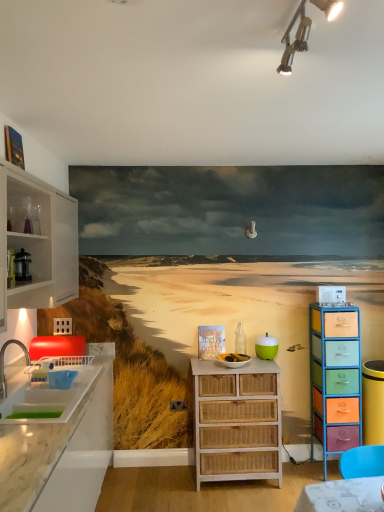
Question: Which direction should I rotate to look at white wicker chest of drawers at center, positioned as the second chest of drawers in right-to-left order?

Choices:
 (A) right
 (B) left

Answer: (A)

Question: Is white plastic microwave at upper right, which is the 3th appliance from front to back, inside metallic track lighting at upper center?

Choices:
 (A) yes
 (B) no

Answer: (B)

Question: From the image's perspective, is metallic track lighting at upper center under white plastic microwave at upper right, the 3th appliance from the left?

Choices:
 (A) yes
 (B) no

Answer: (B)

Question: Is metallic track lighting at upper center at the right side of white plastic microwave at upper right, arranged as the 1th appliance when viewed from the back?

Choices:
 (A) no
 (B) yes

Answer: (A)

Question: Does metallic track lighting at upper center touch white plastic microwave at upper right, which is the 3th appliance from front to back?

Choices:
 (A) yes
 (B) no

Answer: (B)

Question: From a real-world perspective, is metallic track lighting at upper center physically below white plastic microwave at upper right, the 3th appliance from the left?

Choices:
 (A) yes
 (B) no

Answer: (B)

Question: Could you tell me if metallic track lighting at upper center is turned towards white plastic microwave at upper right, acting as the 2th appliance starting from the bottom?

Choices:
 (A) no
 (B) yes

Answer: (A)

Question: Is marble countertop at left oriented towards metallic track lighting at upper center?

Choices:
 (A) yes
 (B) no

Answer: (B)

Question: Can you confirm if marble countertop at left is shorter than metallic track lighting at upper center?

Choices:
 (A) yes
 (B) no

Answer: (B)

Question: From a real-world perspective, is marble countertop at left physically below metallic track lighting at upper center?

Choices:
 (A) yes
 (B) no

Answer: (A)

Question: Does marble countertop at left have a larger size compared to metallic track lighting at upper center?

Choices:
 (A) no
 (B) yes

Answer: (B)

Question: From a real-world perspective, is marble countertop at left over metallic track lighting at upper center?

Choices:
 (A) no
 (B) yes

Answer: (A)

Question: From the image's perspective, is marble countertop at left located above metallic track lighting at upper center?

Choices:
 (A) yes
 (B) no

Answer: (B)

Question: From the image's perspective, is metallic track lighting at upper center under white glass cabinet at left?

Choices:
 (A) yes
 (B) no

Answer: (B)